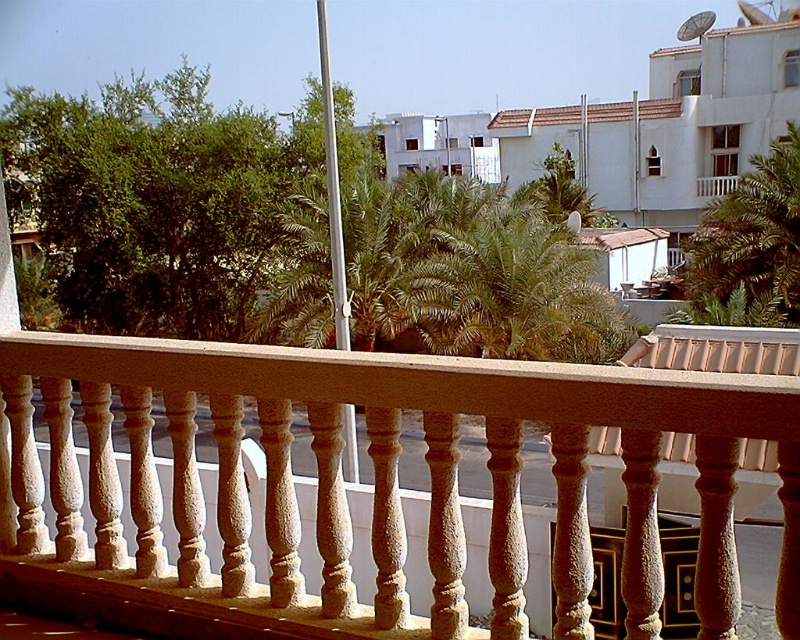
You are standing on the white textured balcony at upper right and want to reach the green leafy palm tree at upper right. Given that the distance between them is 35.14 feet, can you walk directly to the palm tree without any obstacles?

The distance between the green leafy palm tree at upper right and the white textured balcony at upper right is 35.14 feet. However, the scene description mentions that the railing runs horizontally across the foreground and there is a street scene beyond it with vehicles parked. This suggests that there might be physical barriers like railings or the street itself between the balcony and the palm tree, making direct walking impossible. Therefore, you cannot walk directly to the palm tree without obstacles.

You are standing on a balcony and want to see if the smooth beige balustrade at center is taller than the green leafy palm tree at center. Based on the scene, what can you conclude?

The smooth beige balustrade at center is shorter than the green leafy palm tree at center, so the palm tree is taller.

You are standing on a balcony and want to place a small potted plant between the smooth beige balustrade at center and the green leafy palm tree at upper right. Based on their positions, which side of the balustrade should you place it on to be closer to the palm tree?

The smooth beige balustrade at center is to the left of the green leafy palm tree at upper right, so placing the potted plant to the right side of the balustrade would position it closer to the palm tree.